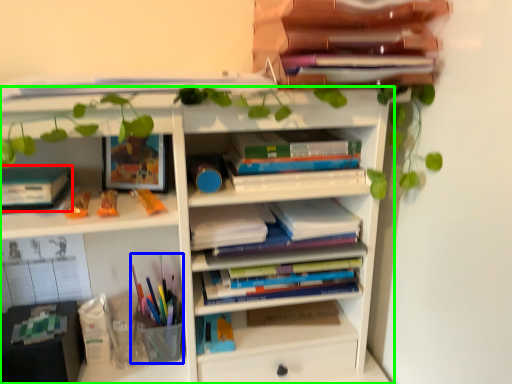
Question: Which object is positioned farthest from paperback book (highlighted by a red box)? Select from stationery (highlighted by a blue box) and shelf (highlighted by a green box).

Choices:
 (A) stationery
 (B) shelf

Answer: (A)